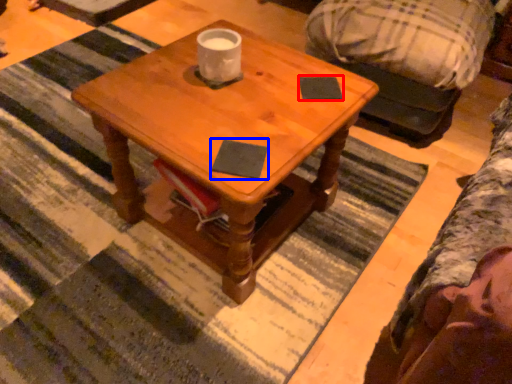
Question: Which of the following is the closest to the observer, notepad (highlighted by a red box) or notepad (highlighted by a blue box)?

Choices:
 (A) notepad
 (B) notepad

Answer: (B)